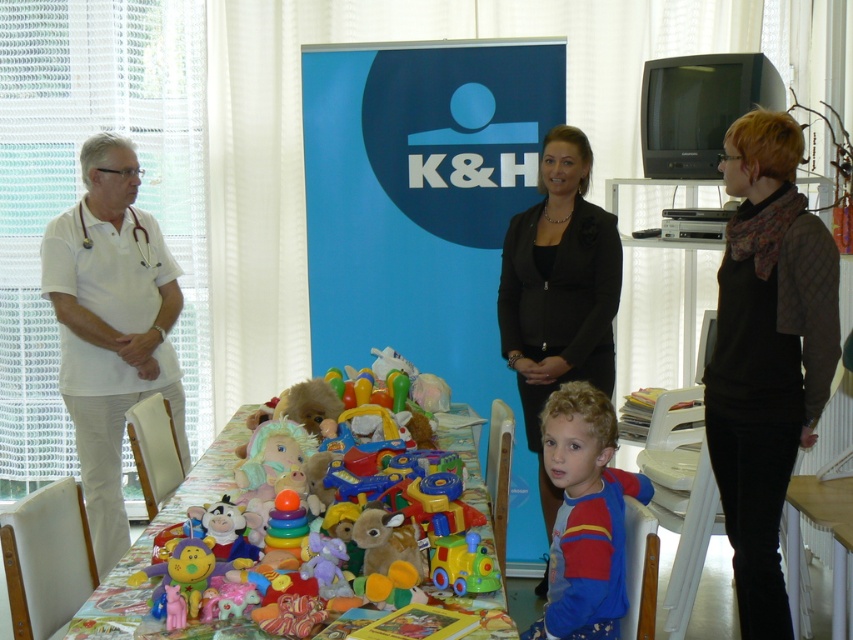
Question: Does quilted scarf at center come behind plastic toys at center?

Choices:
 (A) no
 (B) yes

Answer: (B)

Question: Which object is positioned farthest from the quilted scarf at center?

Choices:
 (A) black smooth blazer at center
 (B) plastic toys at center
 (C) blue cotton shirt at lower center

Answer: (B)

Question: Which object is the closest to the black smooth blazer at center?

Choices:
 (A) quilted scarf at center
 (B) plastic toys at center
 (C) blue cotton shirt at lower center

Answer: (A)

Question: Is white matte shirt at left bigger than plastic toys at center?

Choices:
 (A) no
 (B) yes

Answer: (B)

Question: Which of the following is the farthest from the observer?

Choices:
 (A) black smooth blazer at center
 (B) white matte shirt at left

Answer: (B)

Question: Can you confirm if quilted scarf at center is positioned to the right of white matte shirt at left?

Choices:
 (A) no
 (B) yes

Answer: (B)